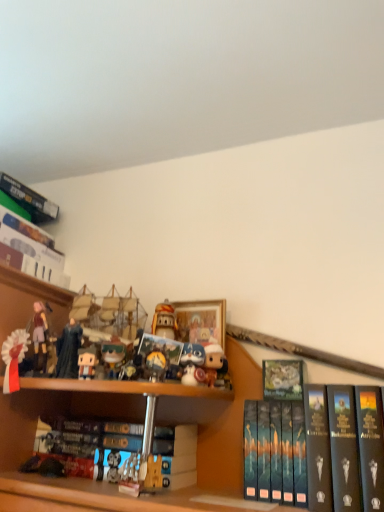
The width and height of the screenshot is (384, 512). What do you see at coordinates (68, 350) in the screenshot?
I see `matte black figurine at center, arranged as the 2th toy when viewed from the left` at bounding box center [68, 350].

In order to face hardcover book at center, which is counted as the 3th book, starting from the right, should I rotate leftwards or rightwards?

To face it directly, rotate left by 9.796 degrees.

What is the approximate width of hardcover book at center, which is counted as the 3th book, starting from the right?

7.78 inches.

Describe the element at coordinates (200, 321) in the screenshot. I see `wooden framed picture at center` at that location.

Image resolution: width=384 pixels, height=512 pixels. Describe the element at coordinates (14, 358) in the screenshot. I see `white fabric ribbon at upper left, the 6th toy in the right-to-left sequence` at that location.

Measure the distance between point (28,337) and camera.

3.54 feet.

Describe the element at coordinates (113, 357) in the screenshot. Image resolution: width=384 pixels, height=512 pixels. I see `matte plastic figurine at center, the 4th toy in the left-to-right sequence` at that location.

Where is `matte black figurine at center, arranged as the 2th toy when viewed from the left`? This screenshot has width=384, height=512. matte black figurine at center, arranged as the 2th toy when viewed from the left is located at coordinates (68, 350).

From a real-world perspective, relative to matte plastic figurine at center, the 4th toy in the left-to-right sequence, is hardcover book at right, acting as the 1th book starting from the right, vertically above or below?

From a real-world perspective, hardcover book at right, acting as the 1th book starting from the right, is physically below matte plastic figurine at center, the 4th toy in the left-to-right sequence.

From the image's perspective, who appears lower, hardcover book at right, acting as the 1th book starting from the right, or matte plastic figurine at center, the 4th toy in the left-to-right sequence?

hardcover book at right, acting as the 1th book starting from the right, is shown below in the image.

Is hardcover book at right, acting as the 1th book starting from the right, oriented towards matte plastic figurine at center, the 4th toy in the left-to-right sequence?

No, hardcover book at right, acting as the 1th book starting from the right, is not aimed at matte plastic figurine at center, the 4th toy in the left-to-right sequence.

Which is more distant, (246, 422) or (125, 349)?

The point (125, 349) is farther from the camera.

Which is more to the right, white plush toy at center, the sixth toy in the left-to-right sequence, or matte black figurine at center, arranged as the 2th toy when viewed from the left?

From the viewer's perspective, white plush toy at center, the sixth toy in the left-to-right sequence, appears more on the right side.

Between white plush toy at center, which ranks as the 1th toy in right-to-left order, and matte black figurine at center, arranged as the 2th toy when viewed from the left, which one has smaller size?

With smaller size is white plush toy at center, which ranks as the 1th toy in right-to-left order.

At what (x,y) coordinates should I click in order to perform the action: click on the 4th toy counting from the left side of the white plush toy at center, the sixth toy in the left-to-right sequence. Please return your answer as a coordinate pair (x, y). Looking at the image, I should click on pos(68,350).

Is point (112, 344) closer to viewer compared to point (76, 421)?

That is True.

From a real-world perspective, is matte plastic figurine at center, the 3th toy when ordered from right to left, positioned above or below hardcover book at center, which is counted as the 3th book, starting from the right?

In terms of real-world spatial position, matte plastic figurine at center, the 3th toy when ordered from right to left, is above hardcover book at center, which is counted as the 3th book, starting from the right.

From the image's perspective, does matte plastic figurine at center, the 4th toy in the left-to-right sequence, appear lower than hardcover book at center, arranged as the 1th book when viewed from the left?

No, from the image's perspective, matte plastic figurine at center, the 4th toy in the left-to-right sequence, is not beneath hardcover book at center, arranged as the 1th book when viewed from the left.

Based on their sizes in the image, would you say matte plastic figurine at center, the 3th toy when ordered from right to left, is bigger or smaller than hardcover book at center, which is counted as the 3th book, starting from the right?

Considering their sizes, matte plastic figurine at center, the 3th toy when ordered from right to left, takes up less space than hardcover book at center, which is counted as the 3th book, starting from the right.

From a real-world perspective, does hardcover book at right, the 3th book in the left-to-right sequence, sit lower than matte plastic figurine at center, which ranks as the fourth toy in right-to-left order?

Yes.

In the scene shown: How distant is hardcover book at right, acting as the 1th book starting from the right, from matte plastic figurine at center, which ranks as the fourth toy in right-to-left order?

hardcover book at right, acting as the 1th book starting from the right, and matte plastic figurine at center, which ranks as the fourth toy in right-to-left order, are 18.68 inches apart from each other.

Image resolution: width=384 pixels, height=512 pixels. What are the coordinates of `the 2nd book directly beneath the matte plastic figurine at center, which is the third toy in left-to-right order (from a real-world perspective)` in the screenshot? It's located at (306, 448).

Considering the positions of objects hardcover book at right, acting as the 1th book starting from the right, and matte black figurine at center, arranged as the 2th toy when viewed from the left, in the image provided, who is more to the right, hardcover book at right, acting as the 1th book starting from the right, or matte black figurine at center, arranged as the 2th toy when viewed from the left,?

hardcover book at right, acting as the 1th book starting from the right, is more to the right.

Does hardcover book at right, acting as the 1th book starting from the right, have a larger size compared to matte black figurine at center, arranged as the 2th toy when viewed from the left?

Indeed, hardcover book at right, acting as the 1th book starting from the right, has a larger size compared to matte black figurine at center, arranged as the 2th toy when viewed from the left.

Which of these two, hardcover book at right, acting as the 1th book starting from the right, or matte black figurine at center, marked as the 5th toy in a right-to-left arrangement, stands taller?

hardcover book at right, acting as the 1th book starting from the right, is taller.

From the image's perspective, between hardcover book at right, the 3th book in the left-to-right sequence, and matte black figurine at center, arranged as the 2th toy when viewed from the left, which one is located above?

matte black figurine at center, arranged as the 2th toy when viewed from the left.

From the image's perspective, is matte plastic figurine at center, which is the third toy in left-to-right order, located above or below matte plastic figurine at center, the 3th toy when ordered from right to left?

From the image's perspective, matte plastic figurine at center, which is the third toy in left-to-right order, appears below matte plastic figurine at center, the 3th toy when ordered from right to left.

Is matte plastic figurine at center, the 4th toy in the left-to-right sequence, located within matte plastic figurine at center, which ranks as the fourth toy in right-to-left order?

No, matte plastic figurine at center, which ranks as the fourth toy in right-to-left order, does not contain matte plastic figurine at center, the 4th toy in the left-to-right sequence.

Can you confirm if matte plastic figurine at center, which ranks as the fourth toy in right-to-left order, is wider than matte plastic figurine at center, the 3th toy when ordered from right to left?

In fact, matte plastic figurine at center, which ranks as the fourth toy in right-to-left order, might be narrower than matte plastic figurine at center, the 3th toy when ordered from right to left.

Could you tell me if matte plastic figurine at center, which ranks as the fourth toy in right-to-left order, is turned towards matte plastic figurine at center, the 3th toy when ordered from right to left?

No, matte plastic figurine at center, which ranks as the fourth toy in right-to-left order, does not turn towards matte plastic figurine at center, the 3th toy when ordered from right to left.

From the image's perspective, is hardcover book at center, arranged as the 1th book when viewed from the left, located above or below hardcover book at upper center, the 2th book in the left-to-right sequence?

hardcover book at center, arranged as the 1th book when viewed from the left, is below hardcover book at upper center, the 2th book in the left-to-right sequence.

Measure the distance between hardcover book at center, which is counted as the 3th book, starting from the right, and hardcover book at upper center, the second book positioned from the right.

The distance of hardcover book at center, which is counted as the 3th book, starting from the right, from hardcover book at upper center, the second book positioned from the right, is 14.40 inches.

Who is smaller, hardcover book at center, arranged as the 1th book when viewed from the left, or hardcover book at upper center, the second book positioned from the right?

Smaller between the two is hardcover book at upper center, the second book positioned from the right.

Find the location of a particular element. This screenshot has height=512, width=384. book that is the 1st one when counting rightward from the hardcover book at center, which is counted as the 3th book, starting from the right is located at coordinates click(283, 379).

Where is `the 2nd book counting from the right of the matte plastic figurine at center, the 3th toy when ordered from right to left`? the 2nd book counting from the right of the matte plastic figurine at center, the 3th toy when ordered from right to left is located at coordinates (306, 448).

Locate an element on the screen. The width and height of the screenshot is (384, 512). the 2nd toy above the white plush toy at center, the sixth toy in the left-to-right sequence (from a real-world perspective) is located at coordinates (68, 350).

Estimate the real-world distances between objects in this image. Which object is further from matte plastic figurine at center, the fifth toy positioned from the left, hardcover book at upper center, the second book positioned from the right, or hardcover book at right, the 3th book in the left-to-right sequence?

hardcover book at right, the 3th book in the left-to-right sequence, is positioned further to the anchor matte plastic figurine at center, the fifth toy positioned from the left.

Looking at the image, which one is located further to white plush toy at center, the sixth toy in the left-to-right sequence, matte plastic figurine at center, the 4th toy in the left-to-right sequence, or matte plastic figurine at center, which is the third toy in left-to-right order?

matte plastic figurine at center, which is the third toy in left-to-right order, is further to white plush toy at center, the sixth toy in the left-to-right sequence.

Looking at this image, looking at the image, which one is located closer to hardcover book at upper center, the second book positioned from the right, hardcover book at right, the 3th book in the left-to-right sequence, or wooden framed picture at center?

The object closer to hardcover book at upper center, the second book positioned from the right, is hardcover book at right, the 3th book in the left-to-right sequence.

Looking at this image, looking at the image, which one is located further to hardcover book at center, which is counted as the 3th book, starting from the right, matte plastic figurine at center, the fifth toy positioned from the left, or matte black figurine at center, marked as the 5th toy in a right-to-left arrangement?

Based on the image, matte plastic figurine at center, the fifth toy positioned from the left, appears to be further to hardcover book at center, which is counted as the 3th book, starting from the right.

From the image, which object appears to be farther from matte plastic figurine at center, the 3th toy when ordered from right to left, wooden framed picture at center or matte plastic figurine at center, the 2th toy viewed from the right?

Based on the image, wooden framed picture at center appears to be further to matte plastic figurine at center, the 3th toy when ordered from right to left.

Looking at the image, which one is located further to matte plastic figurine at center, the 2th toy viewed from the right, hardcover book at center, arranged as the 1th book when viewed from the left, or wooden framed picture at center?

hardcover book at center, arranged as the 1th book when viewed from the left, lies further to matte plastic figurine at center, the 2th toy viewed from the right, than the other object.

From the image, which object appears to be farther from matte plastic figurine at center, the 4th toy in the left-to-right sequence, matte plastic figurine at center, which ranks as the fourth toy in right-to-left order, or wooden framed picture at center?

wooden framed picture at center lies further to matte plastic figurine at center, the 4th toy in the left-to-right sequence, than the other object.

Considering their positions, is hardcover book at upper center, the 2th book in the left-to-right sequence, positioned further to white plush toy at center, the sixth toy in the left-to-right sequence, than hardcover book at right, acting as the 1th book starting from the right?

hardcover book at right, acting as the 1th book starting from the right, is further to white plush toy at center, the sixth toy in the left-to-right sequence.

Identify the location of book between white fabric ribbon at upper left, the 6th toy in the right-to-left sequence, and matte plastic figurine at center, the 2th toy viewed from the right, in the horizontal direction. This screenshot has height=512, width=384. (94, 446).

You are a GUI agent. You are given a task and a screenshot of the screen. Output one action in this format:
    pyautogui.click(x=<x>, y=<y>)
    Task: Click on the book between matte black figurine at center, arranged as the 2th toy when viewed from the left, and wooden framed picture at center
    
    Given the screenshot: What is the action you would take?
    pyautogui.click(x=94, y=446)

This screenshot has height=512, width=384. I want to click on book located between white fabric ribbon at upper left, which is the 1th toy from left to right, and white plush toy at center, which ranks as the 1th toy in right-to-left order, in the left-right direction, so click(94, 446).

You are a GUI agent. You are given a task and a screenshot of the screen. Output one action in this format:
    pyautogui.click(x=<x>, y=<y>)
    Task: Click on the book situated between white fabric ribbon at upper left, the 6th toy in the right-to-left sequence, and hardcover book at upper center, the 2th book in the left-to-right sequence, from left to right
    Image resolution: width=384 pixels, height=512 pixels.
    Given the screenshot: What is the action you would take?
    pyautogui.click(x=94, y=446)